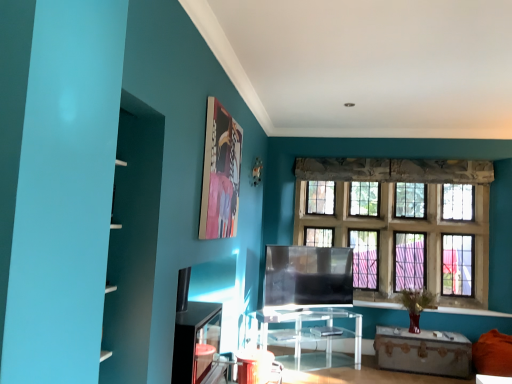
Question: Does matte plastic picture frame at upper center come in front of transparent glass tv at center?

Choices:
 (A) yes
 (B) no

Answer: (A)

Question: Considering the relative sizes of matte plastic picture frame at upper center and transparent glass tv at center in the image provided, is matte plastic picture frame at upper center thinner than transparent glass tv at center?

Choices:
 (A) no
 (B) yes

Answer: (B)

Question: Considering the relative sizes of matte plastic picture frame at upper center and transparent glass tv at center in the image provided, is matte plastic picture frame at upper center bigger than transparent glass tv at center?

Choices:
 (A) no
 (B) yes

Answer: (A)

Question: Does matte plastic picture frame at upper center appear on the right side of transparent glass tv at center?

Choices:
 (A) yes
 (B) no

Answer: (B)

Question: Can you confirm if matte plastic picture frame at upper center is smaller than transparent glass tv at center?

Choices:
 (A) no
 (B) yes

Answer: (B)

Question: Is matte plastic picture frame at upper center to the left of transparent glass tv at center from the viewer's perspective?

Choices:
 (A) yes
 (B) no

Answer: (A)

Question: Considering the relative sizes of transparent glass tv at center and rustic wooden trunk at lower right, the second table when ordered from left to right, in the image provided, is transparent glass tv at center shorter than rustic wooden trunk at lower right, the second table when ordered from left to right,?

Choices:
 (A) no
 (B) yes

Answer: (A)

Question: Are transparent glass tv at center and rustic wooden trunk at lower right, the second table when ordered from left to right, located far from each other?

Choices:
 (A) no
 (B) yes

Answer: (A)

Question: Can you confirm if transparent glass tv at center is bigger than rustic wooden trunk at lower right, the second table when ordered from left to right?

Choices:
 (A) no
 (B) yes

Answer: (A)

Question: Is transparent glass tv at center with rustic wooden trunk at lower right, the second table when ordered from left to right?

Choices:
 (A) no
 (B) yes

Answer: (A)

Question: Is transparent glass tv at center taller than rustic wooden trunk at lower right, marked as the 1th table in a right-to-left arrangement?

Choices:
 (A) no
 (B) yes

Answer: (B)

Question: Can you confirm if transparent glass tv at center is positioned to the right of rustic wooden trunk at lower right, marked as the 1th table in a right-to-left arrangement?

Choices:
 (A) yes
 (B) no

Answer: (B)

Question: Is matte blue bookshelf at left shorter than clear glass windows at center?

Choices:
 (A) no
 (B) yes

Answer: (B)